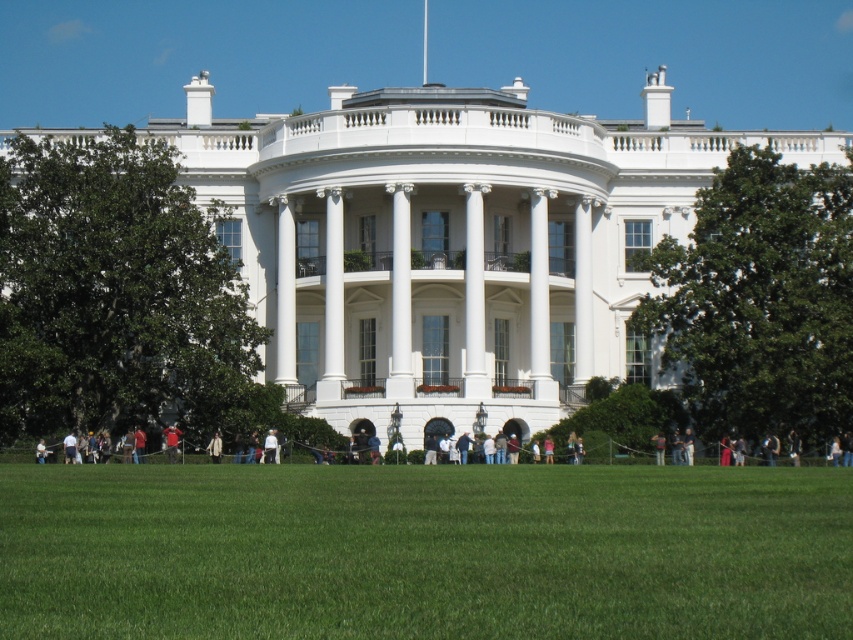
Question: Which object is the farthest from the green grass at lower center?

Choices:
 (A) white cotton shirt at center
 (B) camouflage jacket at center
 (C) light brown leather jacket at center

Answer: (C)

Question: From the image, what is the correct spatial relationship of green grass at lower center in relation to light brown leather jacket at center?

Choices:
 (A) above
 (B) below

Answer: (A)

Question: Which object is the farthest from the light brown leather jacket at center?

Choices:
 (A) camouflage jacket at center
 (B) green grass at lower center
 (C) white cotton shirt at center

Answer: (B)

Question: Does white cotton shirt at center have a larger size compared to camouflage jacket at center?

Choices:
 (A) no
 (B) yes

Answer: (B)

Question: Among these points, which one is farthest from the camera?

Choices:
 (A) (166, 561)
 (B) (276, 429)
 (C) (215, 435)

Answer: (C)

Question: Does light brown leather jacket at center appear on the right side of camouflage jacket at center?

Choices:
 (A) no
 (B) yes

Answer: (A)